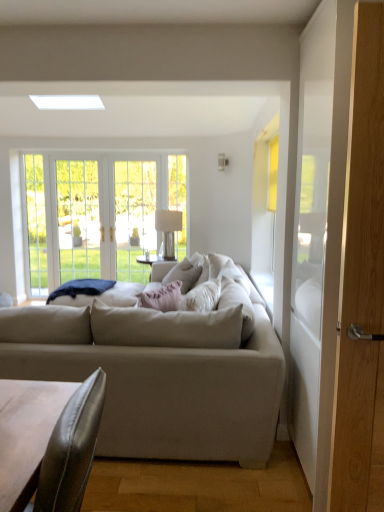
Question: Is wooden screen door at right, marked as the first screen door in a front-to-back arrangement, positioned before clear glass door at center?

Choices:
 (A) yes
 (B) no

Answer: (A)

Question: Is wooden screen door at right, marked as the first screen door in a front-to-back arrangement, in contact with clear glass door at center?

Choices:
 (A) yes
 (B) no

Answer: (B)

Question: Does wooden screen door at right, positioned as the first screen door in right-to-left order, have a lesser width compared to clear glass door at center?

Choices:
 (A) no
 (B) yes

Answer: (A)

Question: Considering the relative positions of wooden screen door at right, positioned as the first screen door in right-to-left order, and clear glass door at center in the image provided, is wooden screen door at right, positioned as the first screen door in right-to-left order, to the right of clear glass door at center from the viewer's perspective?

Choices:
 (A) no
 (B) yes

Answer: (B)

Question: Is clear glass door at center inside wooden screen door at right, placed as the second screen door when sorted from left to right?

Choices:
 (A) no
 (B) yes

Answer: (A)

Question: Considering the positions of point (36, 215) and point (379, 35), is point (36, 215) closer or farther from the camera than point (379, 35)?

Choices:
 (A) farther
 (B) closer

Answer: (A)

Question: From a real-world perspective, is clear glass door at left physically located above or below wooden screen door at right, acting as the 2th screen door starting from the back?

Choices:
 (A) above
 (B) below

Answer: (B)

Question: Is clear glass door at left wider or thinner than wooden screen door at right, marked as the first screen door in a front-to-back arrangement?

Choices:
 (A) wide
 (B) thin

Answer: (B)

Question: From the image's perspective, is clear glass door at left positioned above or below wooden screen door at right, acting as the 2th screen door starting from the back?

Choices:
 (A) below
 (B) above

Answer: (B)

Question: Is clear glass door at center inside or outside of clear glass door at left?

Choices:
 (A) outside
 (B) inside

Answer: (A)

Question: Would you say clear glass door at center is to the left or to the right of clear glass door at left in the picture?

Choices:
 (A) right
 (B) left

Answer: (A)

Question: From the image's perspective, relative to clear glass door at left, is clear glass door at center above or below?

Choices:
 (A) below
 (B) above

Answer: (B)

Question: Considering the positions of clear glass door at center and clear glass door at left in the image, is clear glass door at center taller or shorter than clear glass door at left?

Choices:
 (A) short
 (B) tall

Answer: (A)

Question: Considering the relative positions of wooden screen door at right, placed as the second screen door when sorted from left to right, and leather-like brown coffee table at lower left in the image provided, is wooden screen door at right, placed as the second screen door when sorted from left to right, to the left or to the right of leather-like brown coffee table at lower left?

Choices:
 (A) right
 (B) left

Answer: (A)

Question: From their relative heights in the image, would you say wooden screen door at right, placed as the second screen door when sorted from left to right, is taller or shorter than leather-like brown coffee table at lower left?

Choices:
 (A) short
 (B) tall

Answer: (B)